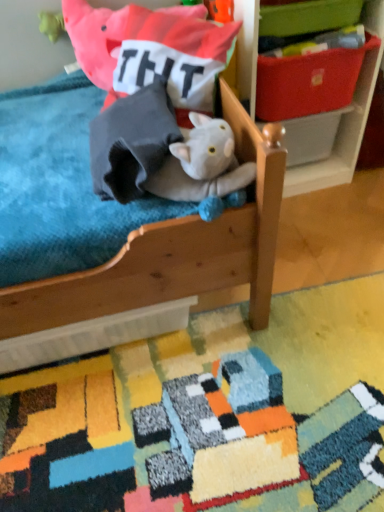
What is the approximate height of soft cotton pillow at upper center?

It is 14.64 inches.

This screenshot has height=512, width=384. What are the coordinates of `multicolored textured rug at lower center` in the screenshot? It's located at (210, 415).

The height and width of the screenshot is (512, 384). What do you see at coordinates (308, 17) in the screenshot?
I see `green fabric storage box at upper right, arranged as the 3th storage box when ordered from the bottom` at bounding box center [308, 17].

The width and height of the screenshot is (384, 512). I want to click on matte plastic storage box at upper right, the 2th storage box ordered from the bottom, so click(x=308, y=82).

Find the location of a particular element. The image size is (384, 512). furniture on the left of the soft cotton pillow at upper center is located at coordinates (154, 271).

Are wooden bed at center and soft cotton pillow at upper center far apart?

No, wooden bed at center is in close proximity to soft cotton pillow at upper center.

Is wooden bed at center behind soft cotton pillow at upper center?

No, wooden bed at center is closer to the viewer.

Is point (114, 264) closer or farther from the camera than point (125, 42)?

Point (114, 264) is positioned closer to the camera compared to point (125, 42).

Is fluffy gray cat at center not within multicolored textured rug at lower center?

fluffy gray cat at center is positioned outside multicolored textured rug at lower center.

Between fluffy gray cat at center and multicolored textured rug at lower center, which one has smaller size?

fluffy gray cat at center is smaller.

Does fluffy gray cat at center have a greater height compared to multicolored textured rug at lower center?

Correct, fluffy gray cat at center is much taller as multicolored textured rug at lower center.

The height and width of the screenshot is (512, 384). Find the location of `mat behind the fluffy gray cat at center`. mat behind the fluffy gray cat at center is located at coordinates (210, 415).

Is green fabric storage box at upper right, arranged as the 3th storage box when ordered from the bottom, shorter than white plastic storage box at center, which ranks as the third storage box in top-to-bottom order?

Yes.

Is green fabric storage box at upper right, the 1th storage box positioned from the top, placed right next to white plastic storage box at center, which ranks as the third storage box in top-to-bottom order?

No.

Is green fabric storage box at upper right, the 1th storage box positioned from the top, spatially inside white plastic storage box at center, the first storage box from the bottom, or outside of it?

green fabric storage box at upper right, the 1th storage box positioned from the top, is not inside white plastic storage box at center, the first storage box from the bottom, it's outside.

Considering the relative sizes of green fabric storage box at upper right, the 1th storage box positioned from the top, and white plastic storage box at center, which ranks as the third storage box in top-to-bottom order, in the image provided, is green fabric storage box at upper right, the 1th storage box positioned from the top, smaller than white plastic storage box at center, which ranks as the third storage box in top-to-bottom order,?

Yes.

Can you confirm if wooden shelf at upper right is thinner than fluffy gray cat at center?

In fact, wooden shelf at upper right might be wider than fluffy gray cat at center.

Is wooden shelf at upper right touching fluffy gray cat at center?

No, wooden shelf at upper right is not beside fluffy gray cat at center.

From the image's perspective, is wooden shelf at upper right located above fluffy gray cat at center?

Correct, wooden shelf at upper right appears higher than fluffy gray cat at center in the image.

Considering the sizes of objects white plastic storage box at center, the first storage box from the bottom, and soft cotton pillow at upper center in the image provided, who is smaller, white plastic storage box at center, the first storage box from the bottom, or soft cotton pillow at upper center?

With smaller size is white plastic storage box at center, the first storage box from the bottom.

Which is behind, white plastic storage box at center, which ranks as the third storage box in top-to-bottom order, or soft cotton pillow at upper center?

white plastic storage box at center, which ranks as the third storage box in top-to-bottom order.

Considering the positions of point (287, 135) and point (148, 21), is point (287, 135) closer or farther from the camera than point (148, 21)?

Clearly, point (287, 135) is more distant from the camera than point (148, 21).

Could you tell me if white plastic storage box at center, the first storage box from the bottom, is facing soft cotton pillow at upper center?

No.

Is soft cotton pillow at upper center looking in the opposite direction of fluffy gray cat at center?

No, soft cotton pillow at upper center is not facing the opposite direction of fluffy gray cat at center.

I want to click on pillow that is above the fluffy gray cat at center (from the image's perspective), so click(151, 50).

From the image's perspective, between soft cotton pillow at upper center and fluffy gray cat at center, which one is located above?

From the image's view, soft cotton pillow at upper center is above.

Is soft cotton pillow at upper center in contact with fluffy gray cat at center?

No.

From a real-world perspective, is wooden shelf at upper right positioned above or below soft cotton pillow at upper center?

wooden shelf at upper right is below soft cotton pillow at upper center.

Is point (375, 14) behind point (144, 9)?

Yes, it is.

Is wooden shelf at upper right in contact with soft cotton pillow at upper center?

wooden shelf at upper right is not next to soft cotton pillow at upper center, and they're not touching.

From the image's perspective, is wooden shelf at upper right on soft cotton pillow at upper center?

Yes, from the image's perspective, wooden shelf at upper right is over soft cotton pillow at upper center.

This screenshot has height=512, width=384. In order to click on furniture on the left of soft cotton pillow at upper center in this screenshot , I will do `click(154, 271)`.

Where is `toy above the multicolored textured rug at lower center (from a real-world perspective)`? toy above the multicolored textured rug at lower center (from a real-world perspective) is located at coordinates (203, 168).

Considering their positions, is matte plastic storage box at upper right, placed as the 2th storage box when sorted from top to bottom, positioned closer to green fabric storage box at upper right, arranged as the 3th storage box when ordered from the bottom, than soft cotton pillow at upper center?

matte plastic storage box at upper right, placed as the 2th storage box when sorted from top to bottom.

From the image, which object appears to be farther from soft cotton pillow at upper center, multicolored textured rug at lower center or wooden bed at center?

Among the two, multicolored textured rug at lower center is located further to soft cotton pillow at upper center.

In the scene shown: When comparing their distances from fluffy gray cat at center, does green fabric storage box at upper right, arranged as the 3th storage box when ordered from the bottom, or soft cotton pillow at upper center seem closer?

Based on the image, soft cotton pillow at upper center appears to be nearer to fluffy gray cat at center.

Which object lies further to the anchor point matte plastic storage box at upper right, placed as the 2th storage box when sorted from top to bottom, gray fabric stuffed animal at upper center or wooden shelf at upper right?

gray fabric stuffed animal at upper center is further to matte plastic storage box at upper right, placed as the 2th storage box when sorted from top to bottom.

From the image, which object appears to be farther from fluffy gray cat at center, multicolored textured rug at lower center or wooden bed at center?

The object further to fluffy gray cat at center is multicolored textured rug at lower center.

Based on the photo, based on their spatial positions, is multicolored textured rug at lower center or white plastic storage box at center, which ranks as the third storage box in top-to-bottom order, further from matte plastic storage box at upper right, the 2th storage box ordered from the bottom?

The object further to matte plastic storage box at upper right, the 2th storage box ordered from the bottom, is multicolored textured rug at lower center.

Based on their spatial positions, is matte plastic storage box at upper right, the 2th storage box ordered from the bottom, or wooden shelf at upper right closer to fluffy gray cat at center?

Based on the image, matte plastic storage box at upper right, the 2th storage box ordered from the bottom, appears to be nearer to fluffy gray cat at center.

When comparing their distances from matte plastic storage box at upper right, the 2th storage box ordered from the bottom, does wooden shelf at upper right or green fabric storage box at upper right, the 1th storage box positioned from the top, seem further?

Based on the image, green fabric storage box at upper right, the 1th storage box positioned from the top, appears to be further to matte plastic storage box at upper right, the 2th storage box ordered from the bottom.

At what (x,y) coordinates should I click in order to perform the action: click on furniture between gray fabric stuffed animal at upper center and multicolored textured rug at lower center from top to bottom. Please return your answer as a coordinate pair (x, y). The image size is (384, 512). Looking at the image, I should click on click(154, 271).

Locate an element on the screen. This screenshot has height=512, width=384. shelf between wooden bed at center and matte plastic storage box at upper right, the 2th storage box ordered from the bottom is located at coordinates (334, 126).

The height and width of the screenshot is (512, 384). In order to click on shelf situated between gray fabric stuffed animal at upper center and white plastic storage box at center, the first storage box from the bottom, from left to right in this screenshot , I will do `click(334, 126)`.

In order to click on toy between wooden bed at center and white plastic storage box at center, which ranks as the third storage box in top-to-bottom order, along the z-axis in this screenshot , I will do 203,168.